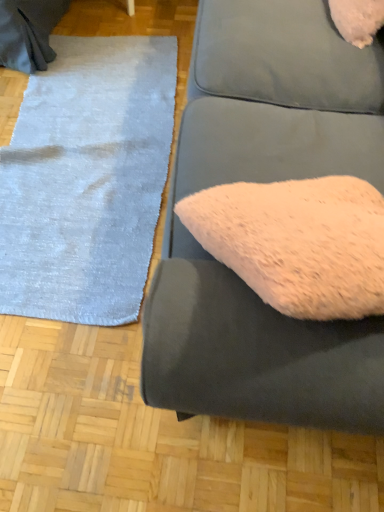
Question: Does light blue plush rug at left have a greater height compared to fuzzy fabric couch at center?

Choices:
 (A) yes
 (B) no

Answer: (B)

Question: Is light blue plush rug at left positioned far away from fuzzy fabric couch at center?

Choices:
 (A) yes
 (B) no

Answer: (B)

Question: Does light blue plush rug at left come behind fuzzy fabric couch at center?

Choices:
 (A) no
 (B) yes

Answer: (B)

Question: Does light blue plush rug at left appear on the right side of fuzzy fabric couch at center?

Choices:
 (A) no
 (B) yes

Answer: (A)

Question: Is fuzzy fabric couch at center a part of light blue plush rug at left?

Choices:
 (A) yes
 (B) no

Answer: (B)

Question: From a real-world perspective, does light blue plush rug at left sit lower than fuzzy fabric couch at center?

Choices:
 (A) yes
 (B) no

Answer: (A)

Question: Is fuzzy fabric couch at center positioned before light blue plush rug at left?

Choices:
 (A) yes
 (B) no

Answer: (A)

Question: From a real-world perspective, is fuzzy fabric couch at center over light blue plush rug at left?

Choices:
 (A) yes
 (B) no

Answer: (A)

Question: Is light blue plush rug at left inside fuzzy fabric couch at center?

Choices:
 (A) yes
 (B) no

Answer: (B)

Question: Considering the relative sizes of fuzzy fabric couch at center and light blue plush rug at left in the image provided, is fuzzy fabric couch at center bigger than light blue plush rug at left?

Choices:
 (A) yes
 (B) no

Answer: (A)

Question: From the image's perspective, is fuzzy fabric couch at center located beneath light blue plush rug at left?

Choices:
 (A) yes
 (B) no

Answer: (A)

Question: Is the position of fuzzy fabric couch at center more distant than that of light blue plush rug at left?

Choices:
 (A) yes
 (B) no

Answer: (B)

Question: Is point click(195, 51) positioned closer to the camera than point click(61, 74)?

Choices:
 (A) farther
 (B) closer

Answer: (B)